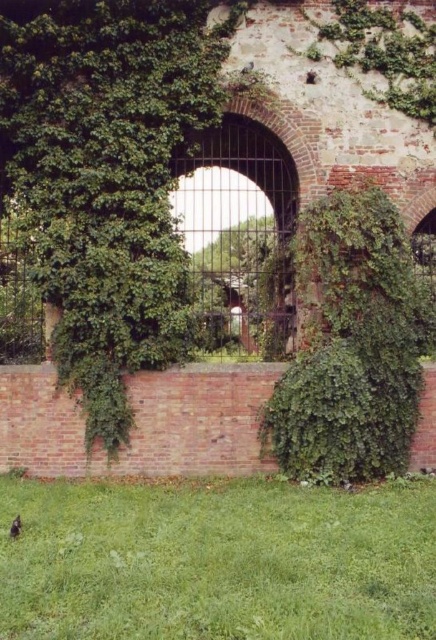
Question: Can you confirm if green grass at lower center is smaller than shiny black bird at lower left?

Choices:
 (A) no
 (B) yes

Answer: (A)

Question: Can you confirm if green grass at lower center is bigger than shiny black bird at lower left?

Choices:
 (A) yes
 (B) no

Answer: (A)

Question: Estimate the real-world distances between objects in this image. Which object is farther from the green leafy ivy at center?

Choices:
 (A) green grass at lower center
 (B) shiny black bird at lower left

Answer: (B)

Question: Observing the image, what is the correct spatial positioning of green leafy ivy at center in reference to shiny black bird at lower left?

Choices:
 (A) right
 (B) left

Answer: (A)

Question: Estimate the real-world distances between objects in this image. Which object is farther from the shiny black bird at lower left?

Choices:
 (A) green leafy ivy at center
 (B) green grass at lower center

Answer: (A)

Question: Among these objects, which one is farthest from the camera?

Choices:
 (A) green grass at lower center
 (B) shiny black bird at lower left
 (C) green leafy ivy at center

Answer: (C)